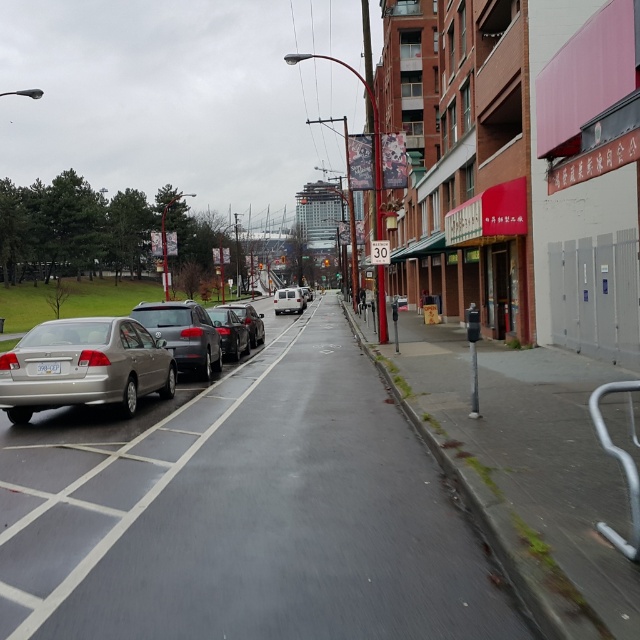
Is shiny black sedan at center to the right of white plastic license plate at center from the viewer's perspective?

Correct, you'll find shiny black sedan at center to the right of white plastic license plate at center.

Where is `shiny black sedan at center`? The width and height of the screenshot is (640, 640). shiny black sedan at center is located at coordinates (230, 332).

Does shiny black sedan at center-left appear on the right side of white plastic license plate at center?

In fact, shiny black sedan at center-left is to the left of white plastic license plate at center.

Is shiny black sedan at center-left closer to camera compared to white plastic license plate at center?

No, shiny black sedan at center-left is behind white plastic license plate at center.

Consider the image. Who is more distant from viewer, [257,336] or [44,368]?

Point [257,336]

This screenshot has height=640, width=640. In order to click on shiny black sedan at center-left in this screenshot , I will do `click(248, 321)`.

Is satin silver sedan at left positioned before shiny black sedan at center?

Yes, it is.

Describe the element at coordinates (182, 333) in the screenshot. This screenshot has height=640, width=640. I see `satin silver sedan at left` at that location.

What do you see at coordinates (182, 333) in the screenshot? I see `satin silver sedan at left` at bounding box center [182, 333].

Find the location of `satin silver sedan at left`. satin silver sedan at left is located at coordinates (182, 333).